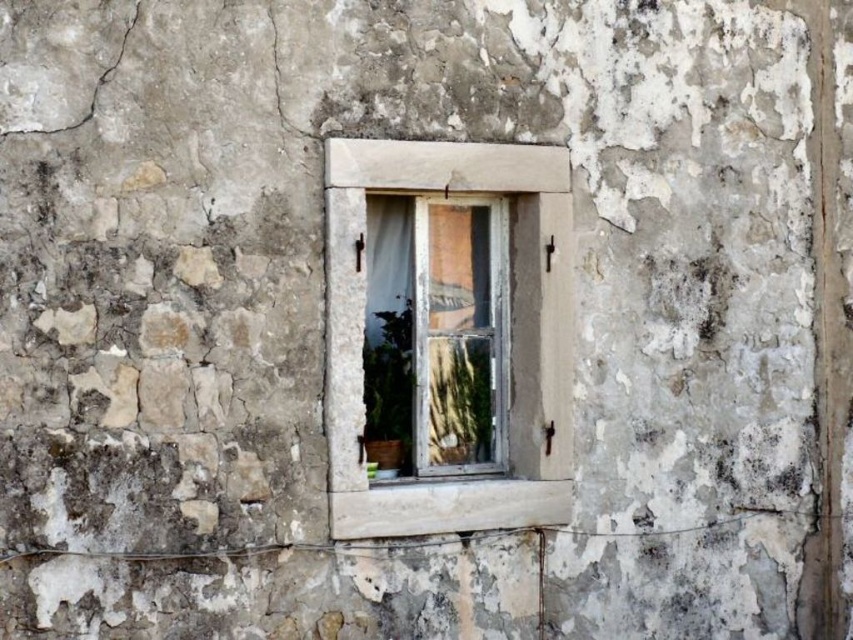
Does point (334, 486) come farther from viewer compared to point (393, 436)?

No, (334, 486) is closer to viewer.

Can you confirm if white stone window frame at center is taller than white wooden window at center?

Yes.

Where is `white stone window frame at center`? The width and height of the screenshot is (853, 640). white stone window frame at center is located at coordinates (363, 323).